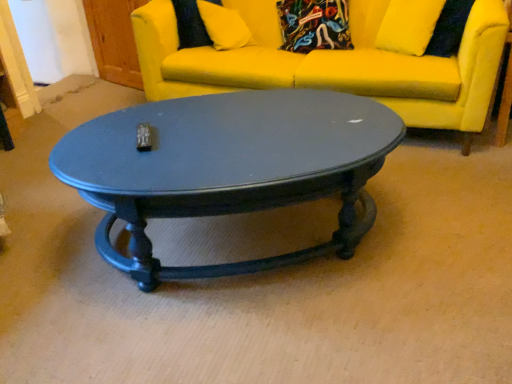
Identify the location of free point below matte black coffee table at center (from a real-world perspective). (252, 237).